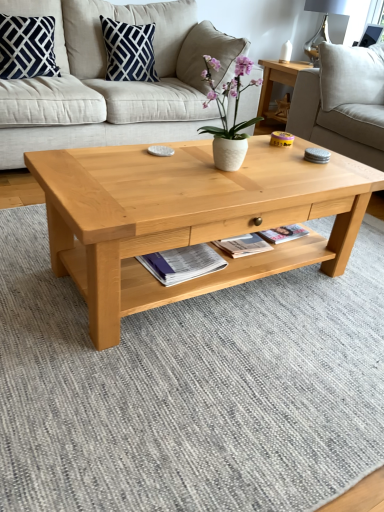
In order to click on vacant area that is in front of light brown wood coffee table at center in this screenshot , I will do `click(208, 395)`.